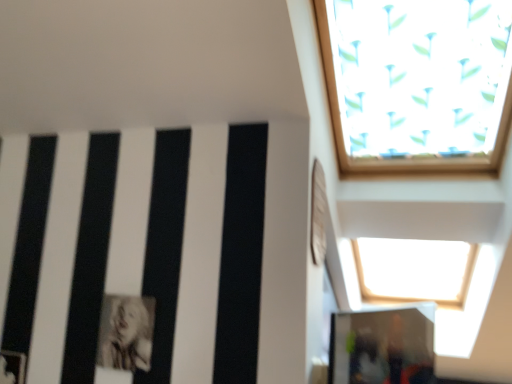
Question: From a real-world perspective, is transparent glass door at lower right over black and white photograph of a person at lower left?

Choices:
 (A) no
 (B) yes

Answer: (A)

Question: From a real-world perspective, is transparent glass door at lower right physically below black and white photograph of a person at lower left?

Choices:
 (A) yes
 (B) no

Answer: (A)

Question: Is transparent glass door at lower right outside black and white photograph of a person at lower left?

Choices:
 (A) yes
 (B) no

Answer: (A)

Question: Is transparent glass door at lower right further to camera compared to black and white photograph of a person at lower left?

Choices:
 (A) yes
 (B) no

Answer: (B)

Question: From the image's perspective, is transparent glass door at lower right above black and white photograph of a person at lower left?

Choices:
 (A) no
 (B) yes

Answer: (A)

Question: Is transparent glass door at lower right shorter than black and white photograph of a person at lower left?

Choices:
 (A) no
 (B) yes

Answer: (A)

Question: Is black and white photograph of a person at lower left at the left side of transparent glass door at lower right?

Choices:
 (A) no
 (B) yes

Answer: (B)

Question: Does black and white photograph of a person at lower left have a greater height compared to transparent glass door at lower right?

Choices:
 (A) no
 (B) yes

Answer: (A)

Question: Does black and white photograph of a person at lower left touch transparent glass door at lower right?

Choices:
 (A) no
 (B) yes

Answer: (A)

Question: Can you confirm if black and white photograph of a person at lower left is positioned to the right of transparent glass door at lower right?

Choices:
 (A) no
 (B) yes

Answer: (A)

Question: Is black and white photograph of a person at lower left far away from transparent glass door at lower right?

Choices:
 (A) yes
 (B) no

Answer: (B)

Question: Can you confirm if black and white photograph of a person at lower left is thinner than transparent glass door at lower right?

Choices:
 (A) yes
 (B) no

Answer: (A)

Question: From a real-world perspective, is black and white photograph of a person at lower left above or below transparent glass door at lower right?

Choices:
 (A) above
 (B) below

Answer: (A)